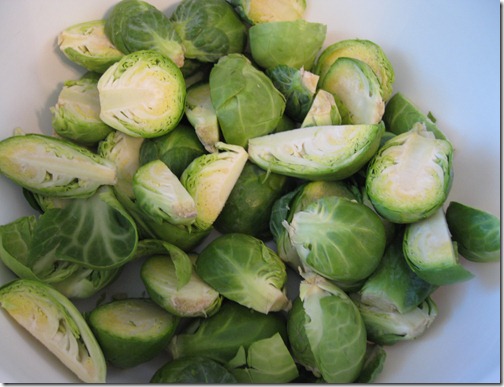
I want to click on bowl, so click(x=456, y=91).